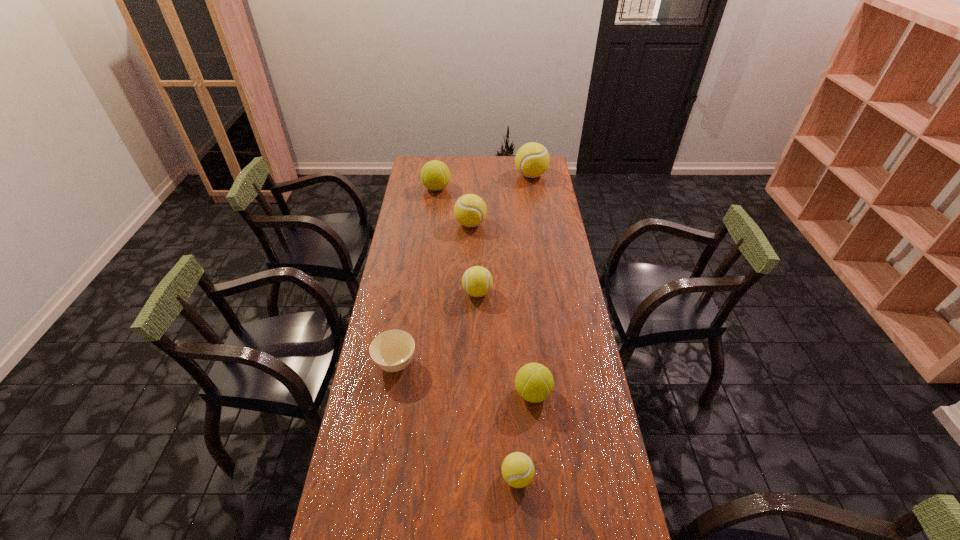
You are a GUI agent. You are given a task and a screenshot of the screen. Output one action in this format:
    pyautogui.click(x=<x>, y=<y>)
    Task: Click on the biggest yellow tennis ball
    
    Given the screenshot: What is the action you would take?
    pyautogui.click(x=532, y=159)

The width and height of the screenshot is (960, 540). I want to click on the rightmost yellow tennis ball, so 532,159.

Where is `the fifth nearest object`? The height and width of the screenshot is (540, 960). the fifth nearest object is located at coordinates (470, 210).

Identify the location of the fourth nearest tennis ball. The height and width of the screenshot is (540, 960). (470, 210).

The height and width of the screenshot is (540, 960). Identify the location of the bigger green tennis ball. (435, 175).

Locate an element on the screen. the left green tennis ball is located at coordinates (435, 175).

In order to click on the third farthest yellow tennis ball in this screenshot , I will do `click(477, 281)`.

The height and width of the screenshot is (540, 960). I want to click on the second smallest yellow tennis ball, so click(x=477, y=281).

This screenshot has width=960, height=540. I want to click on the smaller green tennis ball, so click(534, 382).

The image size is (960, 540). I want to click on the right green tennis ball, so click(x=534, y=382).